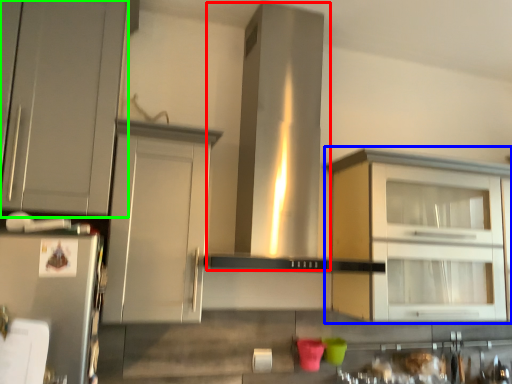
Question: Which object is positioned closest to vent (highlighted by a red box)? Select from cabinetry (highlighted by a blue box) and cabinetry (highlighted by a green box).

Choices:
 (A) cabinetry
 (B) cabinetry

Answer: (A)